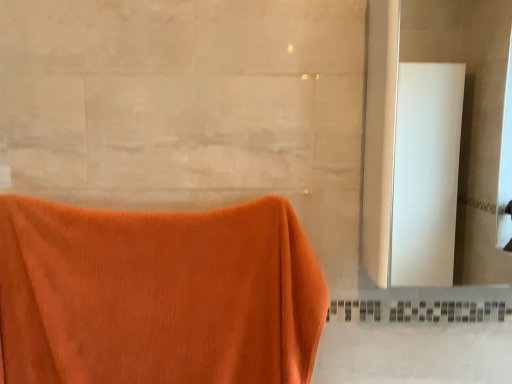
Locate an element on the screen. The height and width of the screenshot is (384, 512). white glossy mirror at right is located at coordinates (470, 116).

Measure the distance between point (445, 58) and camera.

9.59 feet.

What do you see at coordinates (470, 116) in the screenshot? I see `white glossy mirror at right` at bounding box center [470, 116].

Identify the location of white glossy mirror at right. Image resolution: width=512 pixels, height=384 pixels. (470, 116).